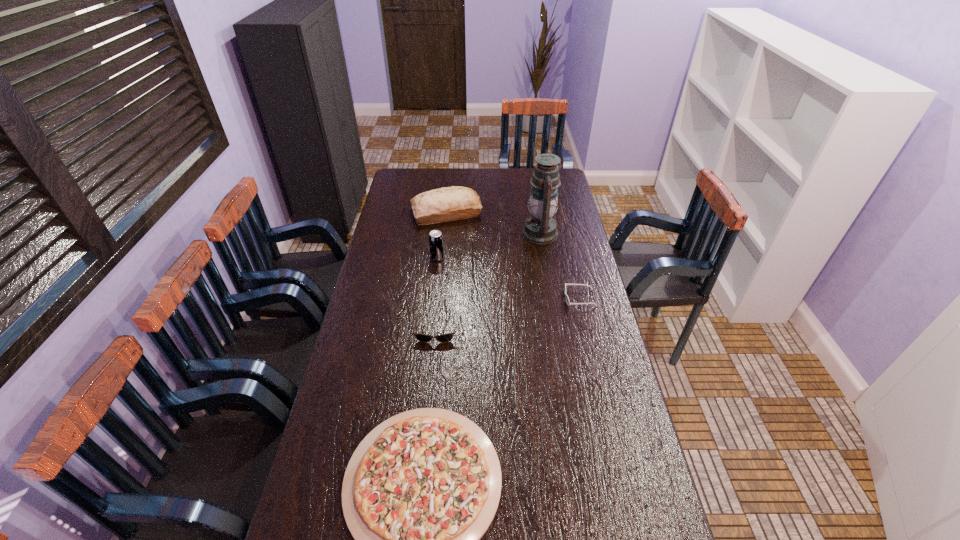
At what (x,y) coordinates should I click in order to perform the action: click on free spot between the soda can and the right sunglasses. Please return your answer as a coordinate pair (x, y). Looking at the image, I should click on point(509,278).

Locate an element on the screen. This screenshot has height=540, width=960. free spot between the farther sunglasses and the nearer sunglasses is located at coordinates (508, 313).

At what (x,y) coordinates should I click in order to perform the action: click on unoccupied area between the fourth nearest object and the tallest object. Please return your answer as a coordinate pair (x, y). Looking at the image, I should click on (490, 246).

Where is `free space between the bread and the fourth farthest object`? The height and width of the screenshot is (540, 960). free space between the bread and the fourth farthest object is located at coordinates (513, 255).

Where is `vacant area that lies between the farther sunglasses and the oil lamp`? The image size is (960, 540). vacant area that lies between the farther sunglasses and the oil lamp is located at coordinates (561, 266).

Where is `free spot between the right sunglasses and the bread`? free spot between the right sunglasses and the bread is located at coordinates (513, 255).

At what (x,y) coordinates should I click in order to perform the action: click on free space between the nearer sunglasses and the right sunglasses. Please return your answer as a coordinate pair (x, y). Image resolution: width=960 pixels, height=540 pixels. Looking at the image, I should click on (508, 313).

The width and height of the screenshot is (960, 540). I want to click on the fifth closest object relative to the bread, so coord(421,489).

Where is `object identified as the fourth closest to the tallest object`? This screenshot has width=960, height=540. object identified as the fourth closest to the tallest object is located at coordinates (447, 337).

Where is `vacant space that satisfies the following two spatial constraints: 1. on the back side of the soda can; 2. on the left side of the bread`? The width and height of the screenshot is (960, 540). vacant space that satisfies the following two spatial constraints: 1. on the back side of the soda can; 2. on the left side of the bread is located at coordinates (443, 213).